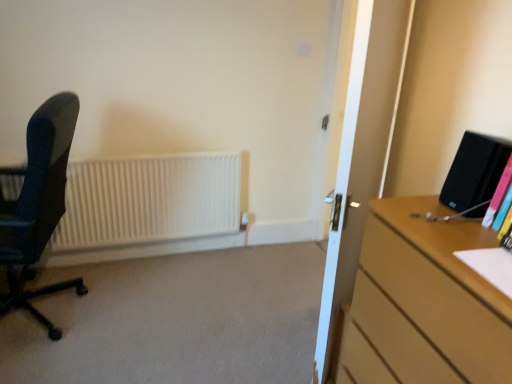
Locate an element on the screen. This screenshot has height=384, width=512. vacant space behind transparent glass door at center is located at coordinates (291, 286).